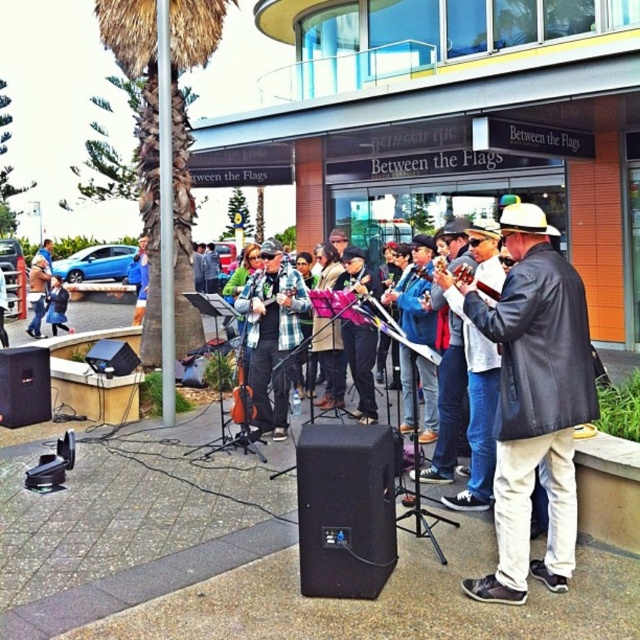
Does green leafy palm tree at left have a greater height compared to light brown leather jacket at center?

No.

You are a GUI agent. You are given a task and a screenshot of the screen. Output one action in this format:
    pyautogui.click(x=<x>, y=<y>)
    Task: Click on the green leafy palm tree at left
    The width and height of the screenshot is (640, 640).
    Given the screenshot: What is the action you would take?
    pyautogui.click(x=140, y=134)

Between leather jacket at center and matte black jacket at center, which one is positioned lower?

leather jacket at center

Image resolution: width=640 pixels, height=640 pixels. Describe the element at coordinates (534, 403) in the screenshot. I see `leather jacket at center` at that location.

Which is in front, point (531, 294) or point (67, 300)?

Point (531, 294)

Where is `leather jacket at center`? leather jacket at center is located at coordinates (x=534, y=403).

Is light brown leather jacket at center taller than matte black jacket at center?

Incorrect, light brown leather jacket at center's height is not larger of matte black jacket at center's.

Between point (44, 294) and point (61, 292), which one is positioned behind?

Positioned behind is point (44, 294).

What do you see at coordinates (36, 292) in the screenshot? The image size is (640, 640). I see `light brown leather jacket at center` at bounding box center [36, 292].

This screenshot has width=640, height=640. Identify the location of light brown leather jacket at center. (36, 292).